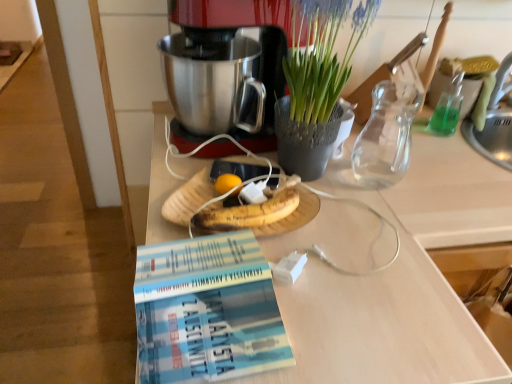
Find the location of a particular element. Image resolution: width=512 pixels, height=384 pixels. vacant region above blue paperback book at lower center (from a real-world perspective) is located at coordinates (214, 272).